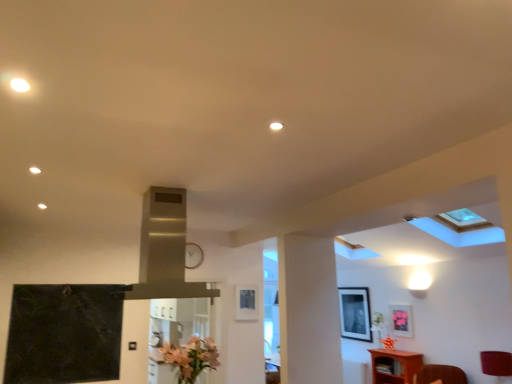
Identify the location of pink matte flower at lower center. (191, 358).

Describe the element at coordinates (355, 313) in the screenshot. I see `matte black picture frame at upper right, the 2th picture frame in the left-to-right sequence` at that location.

What is the approximate width of matte pink picture frame at upper right, which is the first picture frame from right to left?

1.29 inches.

Where is `matte black picture frame at upper center, the first picture frame from the front`? This screenshot has height=384, width=512. matte black picture frame at upper center, the first picture frame from the front is located at coordinates (246, 302).

The image size is (512, 384). What do you see at coordinates (193, 256) in the screenshot?
I see `metallic clock at center` at bounding box center [193, 256].

What do you see at coordinates (164, 249) in the screenshot?
I see `stainless steel exhaust hood at center` at bounding box center [164, 249].

What is the approximate width of brown wooden cabinet at lower right?

brown wooden cabinet at lower right is 32.99 centimeters in width.

At what (x,y) coordinates should I click in order to perform the action: click on pink matte flower at lower center. Please return your answer as a coordinate pair (x, y). Image resolution: width=512 pixels, height=384 pixels. Looking at the image, I should click on (191, 358).

From the image's perspective, is matte black picture frame at upper center, which appears as the third picture frame when viewed from the right, beneath matte pink picture frame at upper right, which is the 3th picture frame from left to right?

No.

Is matte black picture frame at upper center, which is the 1th picture frame in left-to-right order, facing away from matte pink picture frame at upper right, which is the first picture frame from right to left?

No, matte pink picture frame at upper right, which is the first picture frame from right to left, is not at the back of matte black picture frame at upper center, which is the 1th picture frame in left-to-right order.

Can you confirm if matte black picture frame at upper center, which is the 1th picture frame in left-to-right order, is bigger than matte pink picture frame at upper right, which is the first picture frame from right to left?

No, matte black picture frame at upper center, which is the 1th picture frame in left-to-right order, is not bigger than matte pink picture frame at upper right, which is the first picture frame from right to left.

Considering the points (236, 313) and (409, 308), which point is behind, point (236, 313) or point (409, 308)?

The point (409, 308) is behind.

Is stainless steel exhaust hood at center facing away from brown wooden cabinet at lower right?

stainless steel exhaust hood at center is not turned away from brown wooden cabinet at lower right.

Visually, is stainless steel exhaust hood at center positioned to the left or to the right of brown wooden cabinet at lower right?

Based on their positions, stainless steel exhaust hood at center is located to the left of brown wooden cabinet at lower right.

From the image's perspective, is stainless steel exhaust hood at center below brown wooden cabinet at lower right?

No, from the image's perspective, stainless steel exhaust hood at center is not beneath brown wooden cabinet at lower right.

Based on the photo, is stainless steel exhaust hood at center far away from brown wooden cabinet at lower right?

Yes, stainless steel exhaust hood at center and brown wooden cabinet at lower right are located far from each other.

From the image's perspective, does matte pink picture frame at upper right, which is the first picture frame from right to left, appear higher than pink matte flower at lower center?

No.

In terms of width, does matte pink picture frame at upper right, which is the second picture frame from front to back, look wider or thinner when compared to pink matte flower at lower center?

matte pink picture frame at upper right, which is the second picture frame from front to back, is thinner than pink matte flower at lower center.

Considering the relative positions of matte pink picture frame at upper right, which is the first picture frame from right to left, and pink matte flower at lower center in the image provided, is matte pink picture frame at upper right, which is the first picture frame from right to left, to the left or to the right of pink matte flower at lower center?

In the image, matte pink picture frame at upper right, which is the first picture frame from right to left, appears on the right side of pink matte flower at lower center.

Considering the sizes of objects stainless steel exhaust hood at center and matte pink picture frame at upper right, which is the 3th picture frame from left to right, in the image provided, who is taller, stainless steel exhaust hood at center or matte pink picture frame at upper right, which is the 3th picture frame from left to right,?

stainless steel exhaust hood at center.

Considering the relative positions of stainless steel exhaust hood at center and matte pink picture frame at upper right, which is the second picture frame from front to back, in the image provided, is stainless steel exhaust hood at center to the right of matte pink picture frame at upper right, which is the second picture frame from front to back, from the viewer's perspective?

In fact, stainless steel exhaust hood at center is to the left of matte pink picture frame at upper right, which is the second picture frame from front to back.

Is matte pink picture frame at upper right, which is the first picture frame from right to left, completely or partially inside stainless steel exhaust hood at center?

No, matte pink picture frame at upper right, which is the first picture frame from right to left, is not surrounded by stainless steel exhaust hood at center.

Is stainless steel exhaust hood at center far away from matte pink picture frame at upper right, which is the first picture frame from right to left?

Indeed, stainless steel exhaust hood at center is not near matte pink picture frame at upper right, which is the first picture frame from right to left.

Which of these two, matte pink picture frame at upper right, the 2th picture frame positioned from the back, or matte black picture frame at upper right, the 2th picture frame in the left-to-right sequence, is smaller?

matte pink picture frame at upper right, the 2th picture frame positioned from the back, is smaller.

How distant is matte pink picture frame at upper right, which is the second picture frame from front to back, from matte black picture frame at upper right, the second picture frame from the right?

The distance of matte pink picture frame at upper right, which is the second picture frame from front to back, from matte black picture frame at upper right, the second picture frame from the right, is 22.34 inches.

Is matte pink picture frame at upper right, the 2th picture frame positioned from the back, directly adjacent to matte black picture frame at upper right, which appears as the 3th picture frame when viewed from the front?

No, matte pink picture frame at upper right, the 2th picture frame positioned from the back, is not next to matte black picture frame at upper right, which appears as the 3th picture frame when viewed from the front.

Does matte pink picture frame at upper right, which is the second picture frame from front to back, appear on the left side of matte black picture frame at upper right, the second picture frame from the right?

No.

Looking at this image, measure the distance from brown wooden cabinet at lower right to metallic clock at center.

brown wooden cabinet at lower right is 3.44 meters from metallic clock at center.

Would you say brown wooden cabinet at lower right is outside metallic clock at center?

Yes, brown wooden cabinet at lower right is not within metallic clock at center.

Is brown wooden cabinet at lower right wider than metallic clock at center?

Correct, the width of brown wooden cabinet at lower right exceeds that of metallic clock at center.

Is brown wooden cabinet at lower right directly adjacent to metallic clock at center?

No.

You are a GUI agent. You are given a task and a screenshot of the screen. Output one action in this format:
    pyautogui.click(x=<x>, y=<y>)
    Task: Click on the clock behind the pink matte flower at lower center
    The width and height of the screenshot is (512, 384).
    Given the screenshot: What is the action you would take?
    pyautogui.click(x=193, y=256)

Considering the positions of objects metallic clock at center and pink matte flower at lower center in the image provided, who is behind, metallic clock at center or pink matte flower at lower center?

metallic clock at center is further away from the camera.

Which object is positioned more to the left, metallic clock at center or pink matte flower at lower center?

Positioned to the left is metallic clock at center.

Locate an element on the screen. the 1st picture frame positioned below the matte black picture frame at upper center, which appears as the third picture frame when viewed from the right (from the image's perspective) is located at coordinates (401, 320).

Identify the location of furniture on the right of stainless steel exhaust hood at center. This screenshot has height=384, width=512. (394, 366).

Considering their positions, is metallic clock at center positioned further to matte pink picture frame at upper right, the 2th picture frame positioned from the back, than brown wooden cabinet at lower right?

Among the two, metallic clock at center is located further to matte pink picture frame at upper right, the 2th picture frame positioned from the back.

Which object lies nearer to the anchor point matte black picture frame at upper center, the first picture frame from the front, matte black picture frame at upper right, the 2th picture frame in the left-to-right sequence, or metallic clock at center?

The object closer to matte black picture frame at upper center, the first picture frame from the front, is metallic clock at center.

Which object lies further to the anchor point pink matte flower at lower center, matte pink picture frame at upper right, which is the 3th picture frame from left to right, or matte black picture frame at upper right, which appears as the 3th picture frame when viewed from the front?

matte pink picture frame at upper right, which is the 3th picture frame from left to right, is positioned further to the anchor pink matte flower at lower center.

Which object lies further to the anchor point metallic clock at center, brown wooden cabinet at lower right or pink matte flower at lower center?

brown wooden cabinet at lower right is further to metallic clock at center.

Considering their positions, is matte black picture frame at upper center, the first picture frame from the front, positioned further to metallic clock at center than brown wooden cabinet at lower right?

brown wooden cabinet at lower right lies further to metallic clock at center than the other object.

Based on their spatial positions, is matte black picture frame at upper right, the second picture frame from the right, or brown wooden cabinet at lower right closer to pink matte flower at lower center?

matte black picture frame at upper right, the second picture frame from the right, is closer to pink matte flower at lower center.

Considering their positions, is matte pink picture frame at upper right, which is the second picture frame from front to back, positioned further to matte black picture frame at upper right, acting as the first picture frame starting from the back, than brown wooden cabinet at lower right?

brown wooden cabinet at lower right is positioned further to the anchor matte black picture frame at upper right, acting as the first picture frame starting from the back.

When comparing their distances from matte pink picture frame at upper right, the 2th picture frame positioned from the back, does stainless steel exhaust hood at center or brown wooden cabinet at lower right seem closer?

brown wooden cabinet at lower right is positioned closer to the anchor matte pink picture frame at upper right, the 2th picture frame positioned from the back.

Where is `clock between stainless steel exhaust hood at center and brown wooden cabinet at lower right in the front-back direction`? clock between stainless steel exhaust hood at center and brown wooden cabinet at lower right in the front-back direction is located at coordinates 193,256.

What are the coordinates of `flower positioned between stainless steel exhaust hood at center and metallic clock at center from near to far` in the screenshot? It's located at (191, 358).

Where is `clock positioned between pink matte flower at lower center and matte black picture frame at upper center, which is the 1th picture frame in left-to-right order, from near to far`? clock positioned between pink matte flower at lower center and matte black picture frame at upper center, which is the 1th picture frame in left-to-right order, from near to far is located at coordinates (193, 256).

Locate an element on the screen. flower between stainless steel exhaust hood at center and matte pink picture frame at upper right, which is the first picture frame from right to left, along the z-axis is located at coordinates (x=191, y=358).